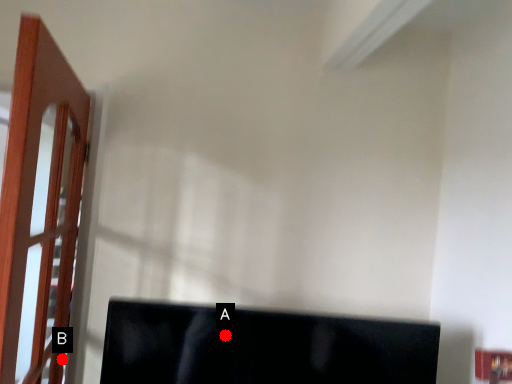
Question: Two points are circled on the image, labeled by A and B beside each circle. Which point appears closest to the camera in this image?

Choices:
 (A) A is closer
 (B) B is closer

Answer: (A)